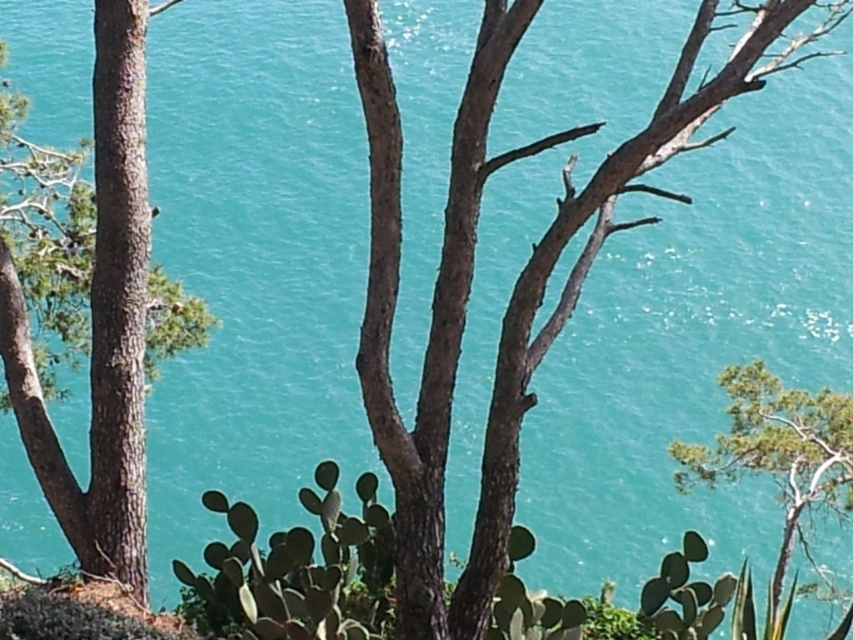
You are standing in front of the scene and want to take a photo of both the brown rough bark tree at left and the green leafy tree at right. Which tree will appear larger in your photo?

The brown rough bark tree at left will appear larger in the photo because it is closer to the viewer than the green leafy tree at right.

You are a bird looking for a place to perch. You see the brown rough bark tree at left and the green leafy tree at right. Which tree is closer to you?

The brown rough bark tree at left is positioned over the green leafy tree at right, meaning it is closer to you.